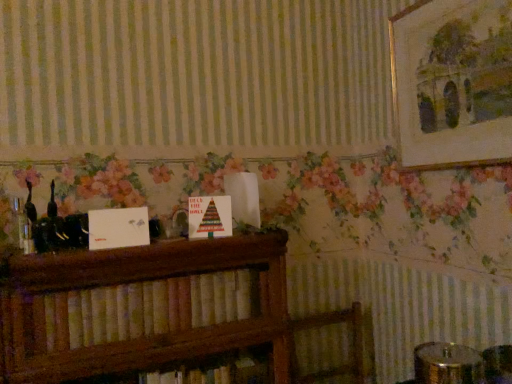
Locate an element on the screen. This screenshot has width=512, height=384. gold-framed painting at upper right is located at coordinates (453, 82).

Measure the distance between gold-framed painting at upper right and camera.

The distance of gold-framed painting at upper right from camera is 4.00 feet.

The width and height of the screenshot is (512, 384). Describe the element at coordinates (453, 82) in the screenshot. I see `gold-framed painting at upper right` at that location.

In order to face gold-framed painting at upper right, should I rotate leftwards or rightwards?

A 23.959 degree turn to the right will do.

What do you see at coordinates (159, 307) in the screenshot? I see `wooden bookshelf at center` at bounding box center [159, 307].

Where is `wooden bookshelf at center`? This screenshot has height=384, width=512. wooden bookshelf at center is located at coordinates (159, 307).

Locate an element on the screen. The width and height of the screenshot is (512, 384). gold-framed painting at upper right is located at coordinates (453, 82).

Considering the relative positions of wooden bookshelf at center and gold-framed painting at upper right in the image provided, is wooden bookshelf at center to the left of gold-framed painting at upper right from the viewer's perspective?

Indeed, wooden bookshelf at center is positioned on the left side of gold-framed painting at upper right.

Considering their positions, is wooden bookshelf at center located in front of or behind gold-framed painting at upper right?

In the image, wooden bookshelf at center appears in front of gold-framed painting at upper right.

Considering the positions of point (145, 335) and point (457, 64), is point (145, 335) closer or farther from the camera than point (457, 64)?

Clearly, point (145, 335) is closer to the camera than point (457, 64).

From the image's perspective, relative to gold-framed painting at upper right, is wooden bookshelf at center above or below?

Clearly, from the image's perspective, wooden bookshelf at center is below gold-framed painting at upper right.

From a real-world perspective, which object stands above the other?

gold-framed painting at upper right is physically above.

Considering the sizes of objects wooden bookshelf at center and gold-framed painting at upper right in the image provided, who is wider, wooden bookshelf at center or gold-framed painting at upper right?

wooden bookshelf at center.

Considering the sizes of objects wooden bookshelf at center and gold-framed painting at upper right in the image provided, who is taller, wooden bookshelf at center or gold-framed painting at upper right?

With more height is gold-framed painting at upper right.

Looking at the image, does wooden bookshelf at center seem bigger or smaller compared to gold-framed painting at upper right?

wooden bookshelf at center is bigger than gold-framed painting at upper right.

Is wooden bookshelf at center outside of gold-framed painting at upper right?

wooden bookshelf at center lies outside gold-framed painting at upper right's area.

Would you say wooden bookshelf at center is a long distance from gold-framed painting at upper right?

No, wooden bookshelf at center is not far away from gold-framed painting at upper right.

Is wooden bookshelf at center facing towards gold-framed painting at upper right?

No, wooden bookshelf at center is not oriented towards gold-framed painting at upper right.

Can you tell me how much wooden bookshelf at center and gold-framed painting at upper right differ in facing direction?

The facing directions of wooden bookshelf at center and gold-framed painting at upper right are 89.5 degrees apart.

Where is `book that is under the gold-framed painting at upper right (from a real-world perspective)`? book that is under the gold-framed painting at upper right (from a real-world perspective) is located at coordinates (159, 307).

Considering the positions of objects gold-framed painting at upper right and wooden bookshelf at center in the image provided, who is more to the right, gold-framed painting at upper right or wooden bookshelf at center?

Positioned to the right is gold-framed painting at upper right.

Is the position of gold-framed painting at upper right less distant than that of wooden bookshelf at center?

No, the depth of gold-framed painting at upper right is greater than that of wooden bookshelf at center.

Is point (459, 123) closer to viewer compared to point (52, 321)?

No, it is behind (52, 321).

From the image's perspective, which is below, gold-framed painting at upper right or wooden bookshelf at center?

wooden bookshelf at center, from the image's perspective.

From a real-world perspective, is gold-framed painting at upper right below wooden bookshelf at center?

Incorrect, from a real-world perspective, gold-framed painting at upper right is higher than wooden bookshelf at center.

From the picture: Does gold-framed painting at upper right have a lesser width compared to wooden bookshelf at center?

Yes, gold-framed painting at upper right is thinner than wooden bookshelf at center.

Does gold-framed painting at upper right have a greater height compared to wooden bookshelf at center?

Correct, gold-framed painting at upper right is much taller as wooden bookshelf at center.

Between gold-framed painting at upper right and wooden bookshelf at center, which one has smaller size?

With smaller size is gold-framed painting at upper right.

Is wooden bookshelf at center located within gold-framed painting at upper right?

No, wooden bookshelf at center is not a part of gold-framed painting at upper right.

Are gold-framed painting at upper right and wooden bookshelf at center far apart?

No, gold-framed painting at upper right is not far away from wooden bookshelf at center.

Is gold-framed painting at upper right facing away from wooden bookshelf at center?

That's not correct — gold-framed painting at upper right is not looking away from wooden bookshelf at center.

Can you tell me how much gold-framed painting at upper right and wooden bookshelf at center differ in facing direction?

There is a 89.5-degree angle between the facing directions of gold-framed painting at upper right and wooden bookshelf at center.

Locate an element on the screen. The height and width of the screenshot is (384, 512). book on the left side of gold-framed painting at upper right is located at coordinates (159, 307).

The height and width of the screenshot is (384, 512). In order to click on picture frame that appears on the right of wooden bookshelf at center in this screenshot , I will do `click(453, 82)`.

Identify the location of picture frame lying above the wooden bookshelf at center (from the image's perspective). Image resolution: width=512 pixels, height=384 pixels. click(453, 82).